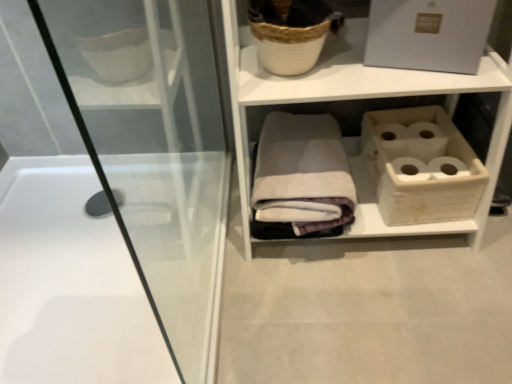
Question: Based on their sizes in the image, would you say gray cotton bath towel at center is bigger or smaller than white woven basket at upper center?

Choices:
 (A) big
 (B) small

Answer: (B)

Question: In terms of height, does gray cotton bath towel at center look taller or shorter compared to white woven basket at upper center?

Choices:
 (A) tall
 (B) short

Answer: (B)

Question: Which object is the farthest from the white glossy bathtub at left?

Choices:
 (A) white woven basket at upper center
 (B) gray cotton bath towel at center

Answer: (A)

Question: Which is nearer to the white woven basket at upper center?

Choices:
 (A) white glossy bathtub at left
 (B) gray cotton bath towel at center

Answer: (B)